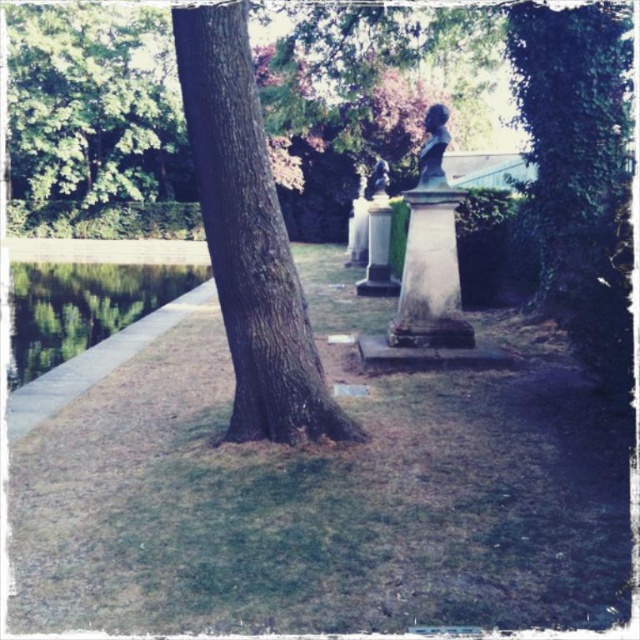
You are standing in the park and want to take a photo of the green leafy tree at upper left. If your camera has a maximum zoom range of 25 meters, will you be able to capture the tree clearly without moving closer?

The green leafy tree at upper left is 30.67 meters away from the viewer. Since the camera can only zoom up to 25 meters, you won not be able to capture the tree clearly without moving closer.

You are a photographer standing at the edge of the green smooth water at lower left. You want to take a picture of the satin bronze bust at upper right. Is the bust visible from your current position?

The green smooth water at lower left is located below the satin bronze bust at upper right, so yes, the bust is visible from the photographer position at the water edge.